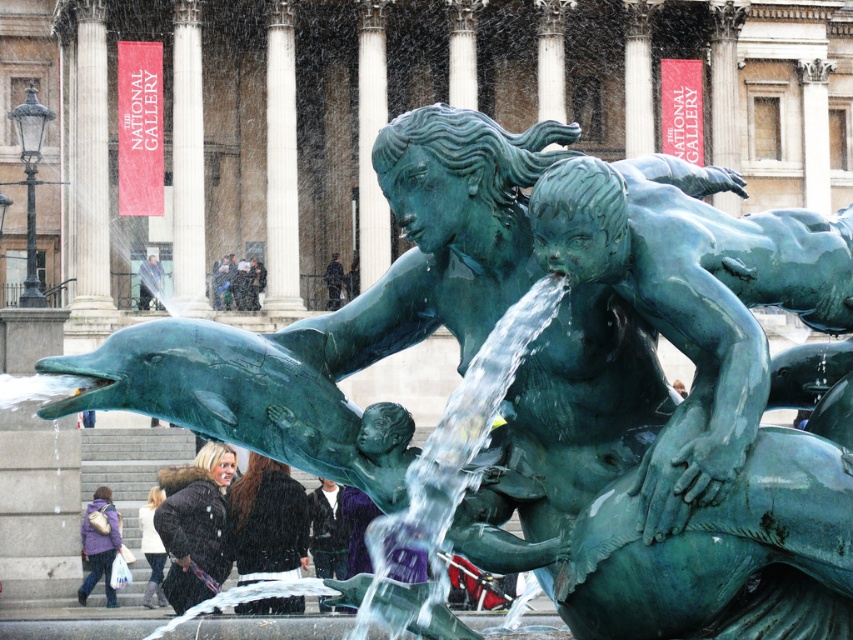
The height and width of the screenshot is (640, 853). What are the coordinates of `purple fabric jacket at lower left` in the screenshot? It's located at (99, 545).

Locate an element on the screen. This screenshot has width=853, height=640. purple fabric jacket at lower left is located at coordinates (99, 545).

Is dark brown fur coat at lower left thinner than smooth skin person at lower left?

No, dark brown fur coat at lower left is not thinner than smooth skin person at lower left.

Who is shorter, dark brown fur coat at lower left or smooth skin person at lower left?

smooth skin person at lower left is shorter.

This screenshot has width=853, height=640. What are the coordinates of `dark brown fur coat at lower left` in the screenshot? It's located at [195, 524].

The width and height of the screenshot is (853, 640). What are the coordinates of `dark brown fur coat at lower left` in the screenshot? It's located at (195, 524).

Looking at this image, which is below, green patina statue at center or green patina column at center?

green patina statue at center is lower down.

Is green patina statue at center taller than green patina column at center?

Incorrect, green patina statue at center's height is not larger of green patina column at center's.

This screenshot has height=640, width=853. I want to click on green patina statue at center, so click(x=694, y=300).